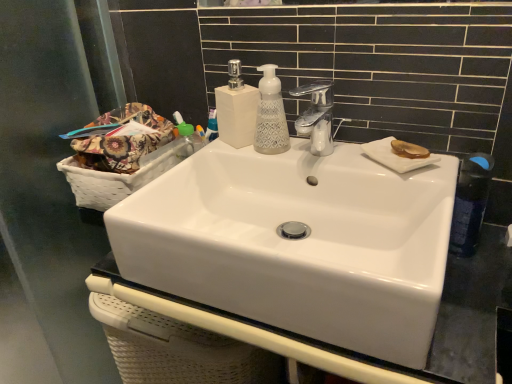
Locate an element on the screen. This screenshot has width=512, height=384. vacant space that is to the left of translucent amber plate at upper right is located at coordinates (340, 159).